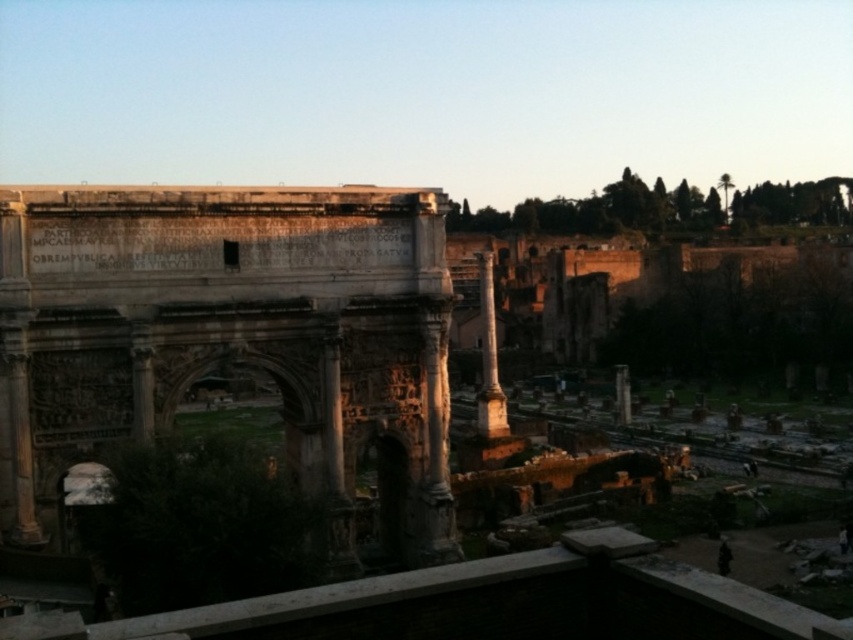
You are a historian standing at the ancient Roman site. You notice the gray stone arch at center and the white marble column at center. Which object is closer to you?

The gray stone arch at center is closer to you because it is in front of the white marble column at center.

You are an archaeologist examining the ancient Roman site. You notice the gray stone arch at center and the white marble column at center. Which structure would cast a longer shadow given the current lighting conditions?

The gray stone arch at center is larger in size than the white marble column at center, so it would cast a longer shadow.